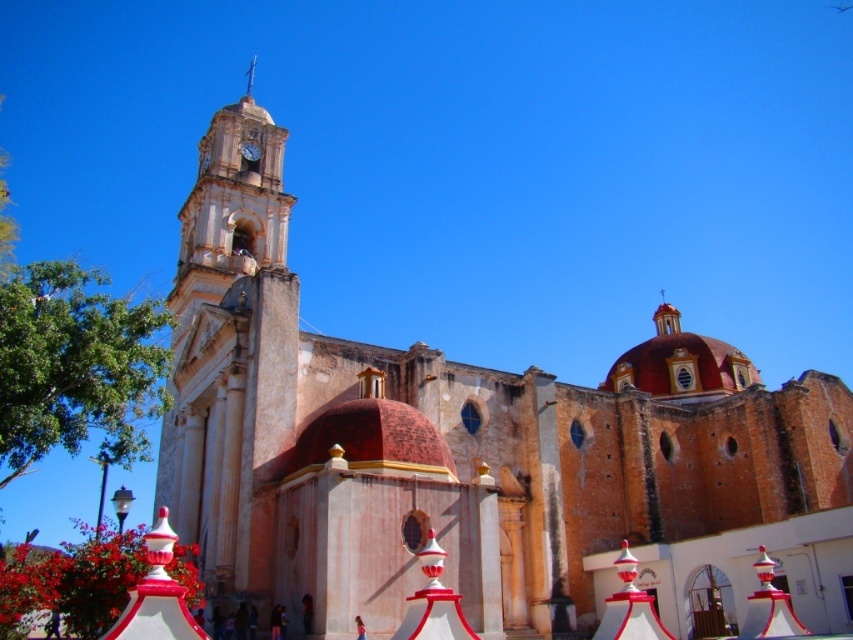
Question: Which point is closer to the camera?

Choices:
 (A) (250, 83)
 (B) (236, 547)
 (C) (248, 152)

Answer: (B)

Question: Where is metallic clock at upper center located in relation to smooth silver spire at upper center in the image?

Choices:
 (A) right
 (B) left

Answer: (A)

Question: Which of these objects is positioned closest to the stone clock tower at left?

Choices:
 (A) metallic clock at upper center
 (B) smooth silver spire at upper center

Answer: (A)

Question: Among these objects, which one is nearest to the camera?

Choices:
 (A) smooth silver spire at upper center
 (B) metallic clock at upper center

Answer: (B)

Question: Does metallic clock at upper center come in front of smooth silver spire at upper center?

Choices:
 (A) no
 (B) yes

Answer: (B)

Question: Can you confirm if stone clock tower at left is bigger than smooth silver spire at upper center?

Choices:
 (A) yes
 (B) no

Answer: (A)